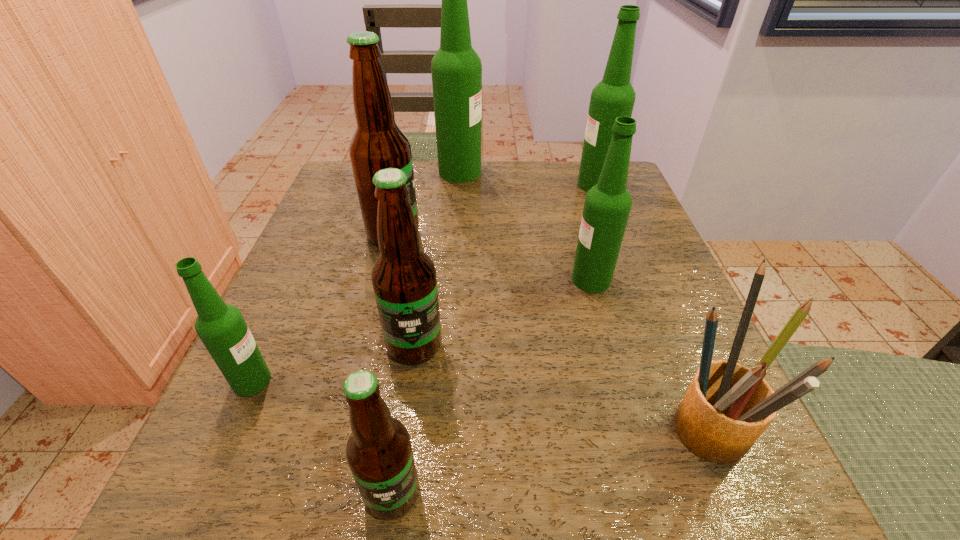
Where is `the biggest green beer bottle`? Image resolution: width=960 pixels, height=540 pixels. the biggest green beer bottle is located at coordinates (456, 68).

Where is `the third green beer bottle from right to left`? The width and height of the screenshot is (960, 540). the third green beer bottle from right to left is located at coordinates (456, 68).

At what (x,y) coordinates should I click in order to perform the action: click on the third smallest green beer bottle. Please return your answer as a coordinate pair (x, y). The width and height of the screenshot is (960, 540). Looking at the image, I should click on (614, 96).

Find the location of `the sixth nearest object`. the sixth nearest object is located at coordinates (378, 143).

Locate an element on the screen. The height and width of the screenshot is (540, 960). the farthest brown beer bottle is located at coordinates (378, 143).

Where is `the fourth nearest beer bottle`? This screenshot has width=960, height=540. the fourth nearest beer bottle is located at coordinates (607, 205).

Locate an element on the screen. This screenshot has width=960, height=540. the fifth nearest object is located at coordinates (607, 205).

Where is `the second farthest brown beer bottle`? Image resolution: width=960 pixels, height=540 pixels. the second farthest brown beer bottle is located at coordinates (404, 279).

Find the location of a particular element. pencil box is located at coordinates (726, 408).

You are a GUI agent. You are given a task and a screenshot of the screen. Output one action in this format:
    pyautogui.click(x=<x>, y=<y>)
    Task: Click on the leftmost object
    The width and height of the screenshot is (960, 540).
    Given the screenshot: What is the action you would take?
    pos(221,327)